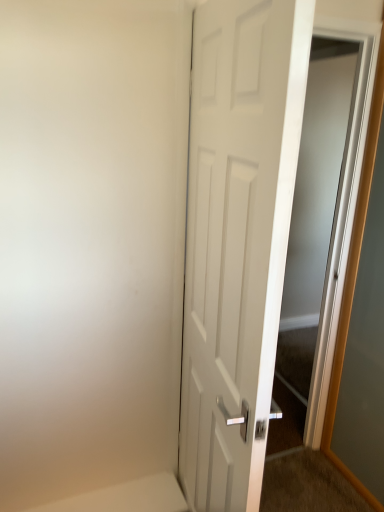
Question: From a real-world perspective, is white matte door at center above or below white glossy elevator at right?

Choices:
 (A) below
 (B) above

Answer: (A)

Question: Is white matte door at center in front of or behind white glossy elevator at right in the image?

Choices:
 (A) front
 (B) behind

Answer: (A)

Question: Would you say white matte door at center is inside or outside white glossy elevator at right?

Choices:
 (A) outside
 (B) inside

Answer: (A)

Question: Is point (349, 132) positioned closer to the camera than point (200, 302)?

Choices:
 (A) farther
 (B) closer

Answer: (A)

Question: Looking at the image, does white glossy elevator at right seem bigger or smaller compared to white matte door at center?

Choices:
 (A) small
 (B) big

Answer: (A)

Question: Is white glossy elevator at right in front of or behind white matte door at center in the image?

Choices:
 (A) front
 (B) behind

Answer: (B)

Question: In terms of width, does white glossy elevator at right look wider or thinner when compared to white matte door at center?

Choices:
 (A) wide
 (B) thin

Answer: (B)